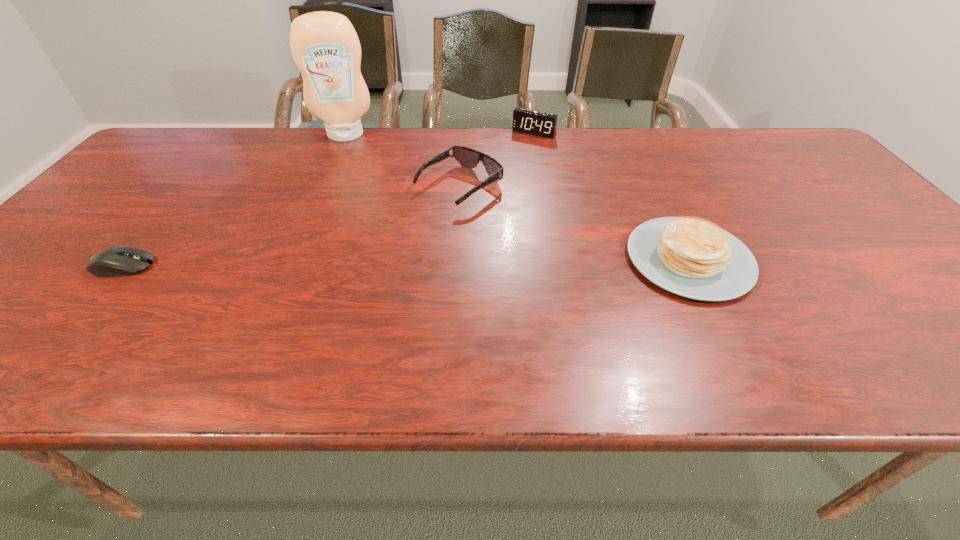
I want to click on vacant area that lies between the second object from left to right and the third object from left to right, so click(x=402, y=161).

The width and height of the screenshot is (960, 540). Identify the location of empty space between the third farthest object and the pancake. (574, 224).

You are a GUI agent. You are given a task and a screenshot of the screen. Output one action in this format:
    pyautogui.click(x=<x>, y=<y>)
    Task: Click on the empty location between the tallest object and the pancake
    Image resolution: width=960 pixels, height=540 pixels.
    Given the screenshot: What is the action you would take?
    pyautogui.click(x=517, y=197)

Find the location of `free space between the alarm clock and the computer mouse`. free space between the alarm clock and the computer mouse is located at coordinates (328, 199).

What are the coordinates of `free area in between the rightmost object and the shortest object` in the screenshot? It's located at (406, 262).

The image size is (960, 540). Identify the location of free space between the pancake and the second object from right to left. (612, 196).

Locate an element on the screen. The width and height of the screenshot is (960, 540). free space between the fourth object from right to left and the fourth object from left to right is located at coordinates (440, 134).

I want to click on vacant space in between the sunglasses and the computer mouse, so click(x=291, y=227).

Find the location of a particular element. This screenshot has width=960, height=540. the third closest object relative to the second object from left to right is located at coordinates click(x=116, y=261).

Locate an element on the screen. This screenshot has width=960, height=540. object identified as the closest to the pancake is located at coordinates (467, 157).